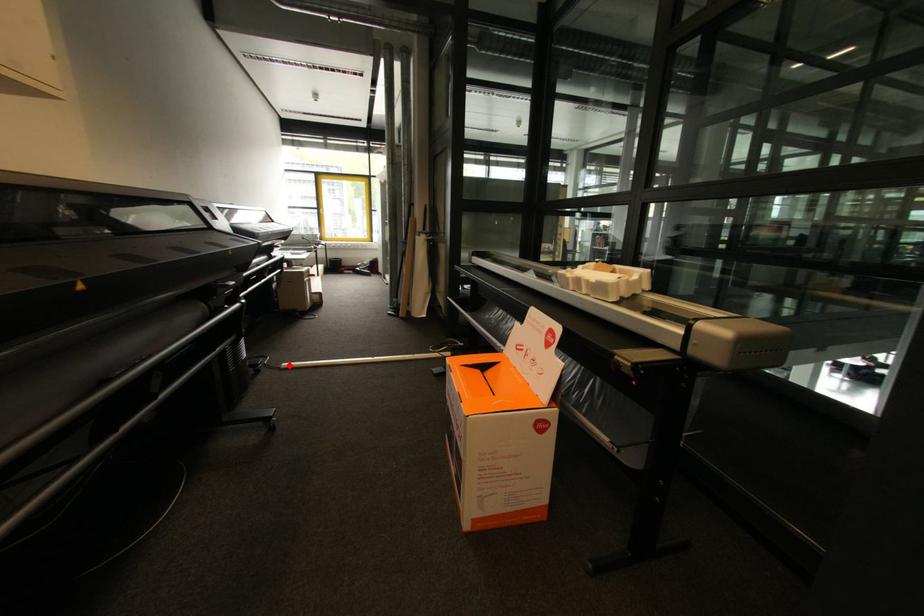
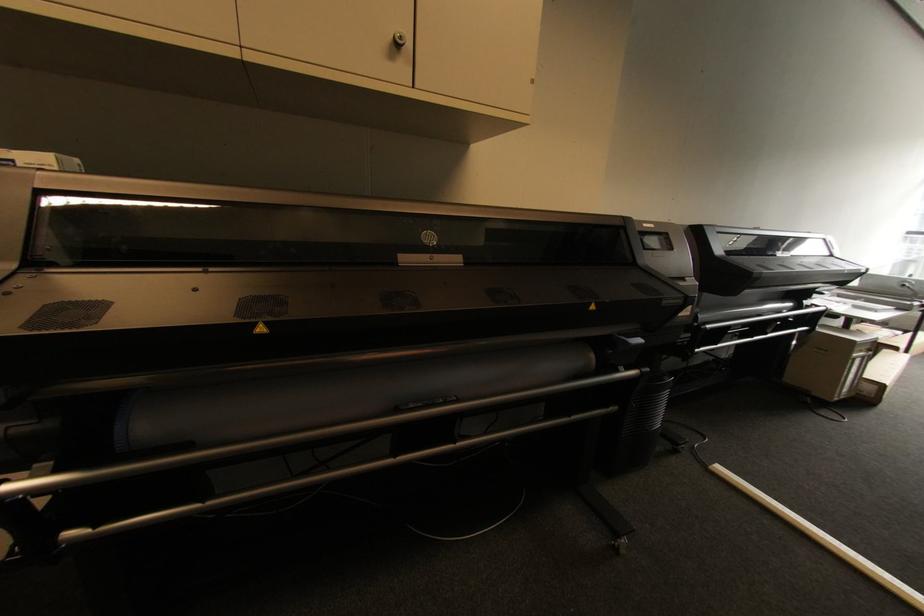
Question: A red point is marked in image1. In image2, is the corresponding 3D point closer to the camera or farther? Reply with the corresponding letter.

Choices:
 (A) The corresponding 3D point is closer.
 (B) The corresponding 3D point is farther.

Answer: (B)